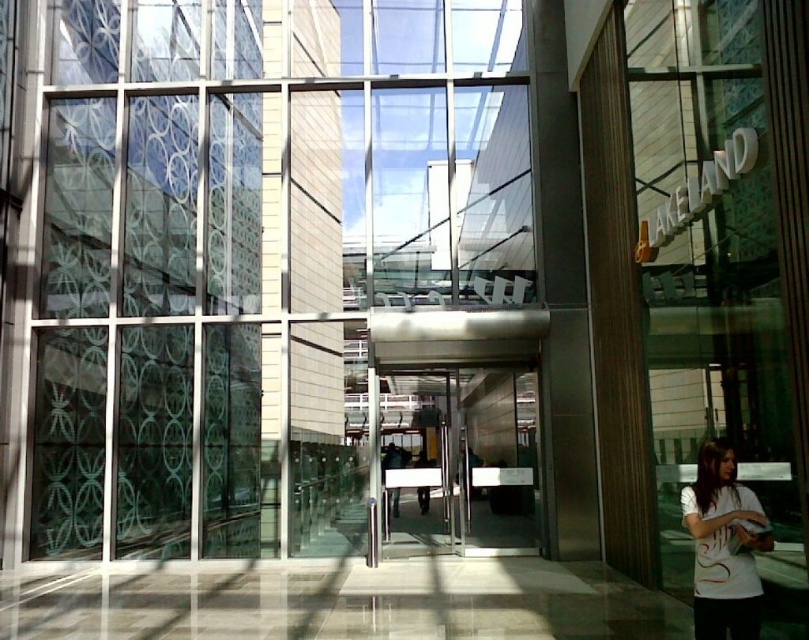
Is transparent glass door at center above white cotton t-shirt at lower right?

No.

Does transparent glass door at center have a smaller size compared to white cotton t-shirt at lower right?

No.

Consider the image. Measure the distance between point (x=434, y=472) and camera.

Point (x=434, y=472) and camera are 9.32 meters apart.

Locate an element on the screen. transparent glass door at center is located at coordinates (464, 456).